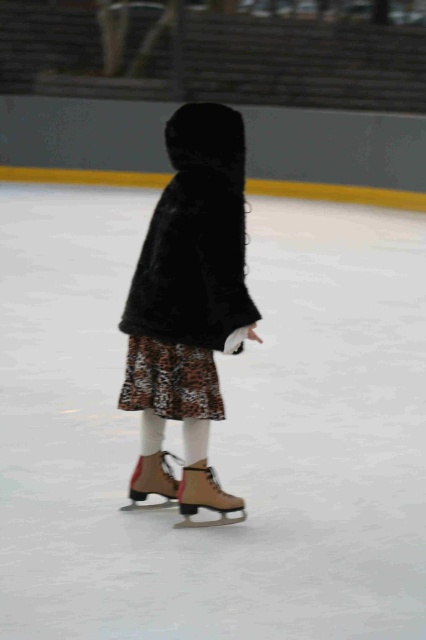
Question: Is brown leather roller skate at center below brown suede roller skate at center?

Choices:
 (A) yes
 (B) no

Answer: (A)

Question: Can you confirm if white ice at center is wider than brown suede roller skate at center?

Choices:
 (A) no
 (B) yes

Answer: (B)

Question: Among these points, which one is farthest from the camera?

Choices:
 (A) (144, 476)
 (B) (204, 499)
 (C) (365, 356)
 (D) (212, 307)

Answer: (C)

Question: Which of the following is the farthest from the observer?

Choices:
 (A) brown leather roller skate at center
 (B) black fuzzy coat at center

Answer: (A)

Question: Is white ice at center above black fuzzy coat at center?

Choices:
 (A) yes
 (B) no

Answer: (B)

Question: Among these points, which one is nearest to the camera?

Choices:
 (A) (229, 164)
 (B) (187, 468)
 (C) (316, 221)
 (D) (161, 493)

Answer: (A)